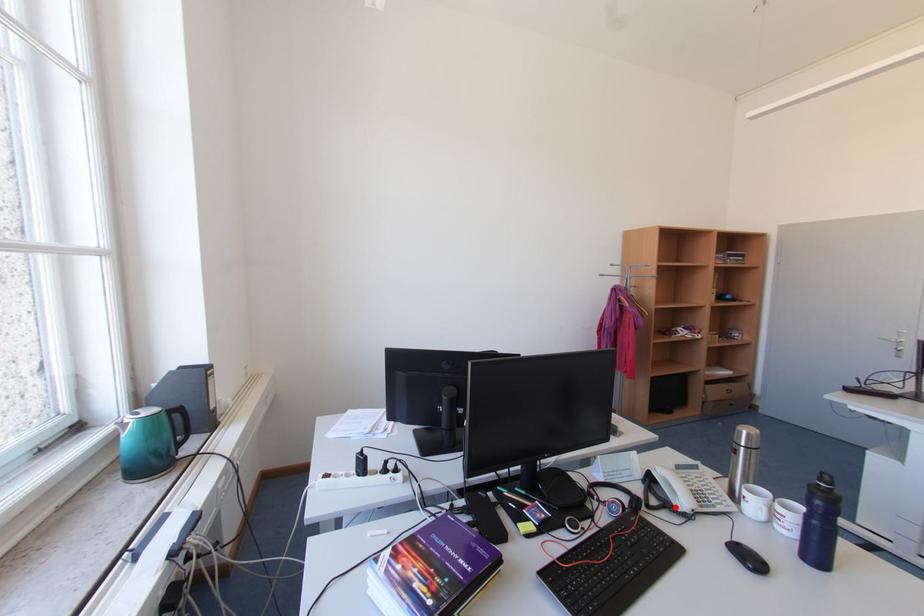
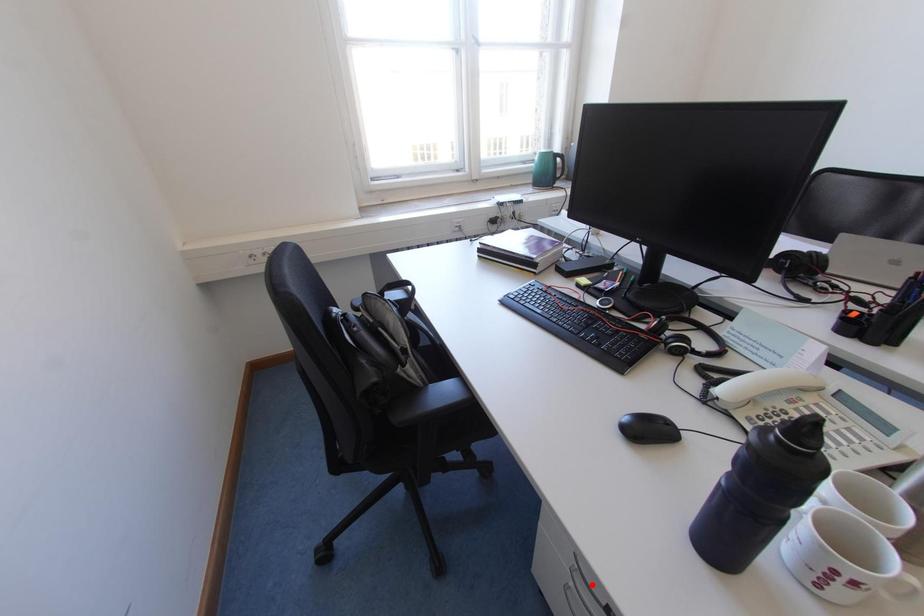
From the picture: I am providing you with two images of the same scene from different viewpoints. A red point is marked on the first image and another point is marked on the second image. Are the points marked in image1 and image2 representing the same 3D position?

No